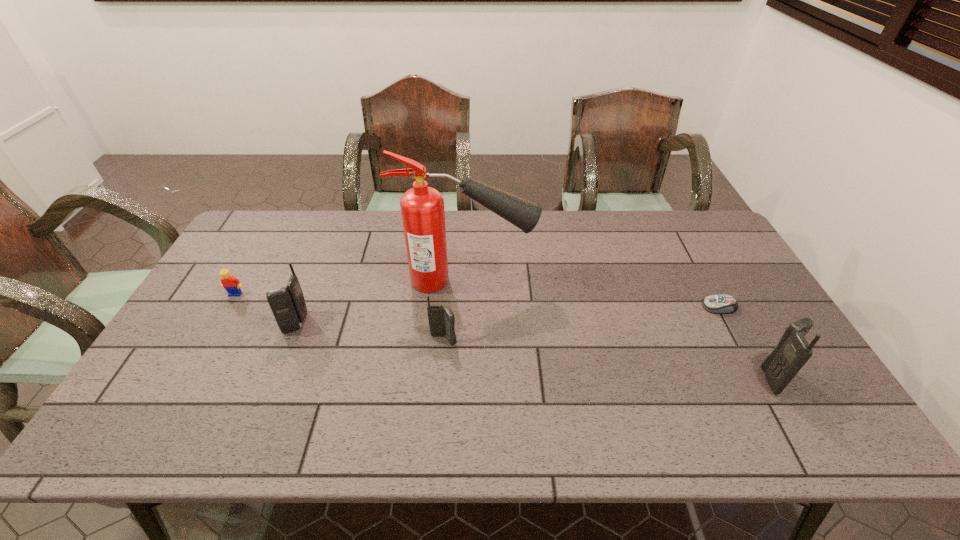
I want to click on free region that satisfies the following two spatial constraints: 1. on the wheel side of the shortest object; 2. on the keyboard of the fourth tallest object, so click(x=737, y=340).

At what (x,y) coordinates should I click in order to perform the action: click on free space in the image that satisfies the following two spatial constraints: 1. at the nozzle of the fire extinguisher; 2. on the face of the Lego. Please return your answer as a coordinate pair (x, y). Looking at the image, I should click on (465, 294).